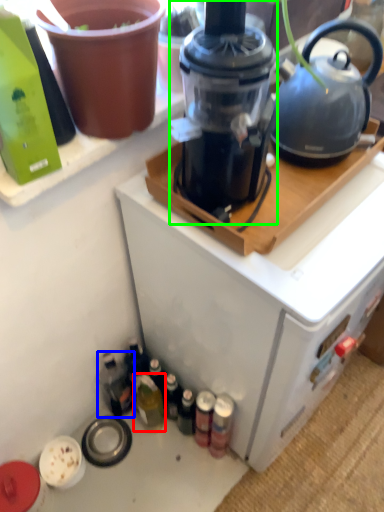
Question: Based on their relative distances, which object is farther from bottle (highlighted by a red box)? Choose from bottle (highlighted by a blue box) and blender (highlighted by a green box).

Choices:
 (A) bottle
 (B) blender

Answer: (B)